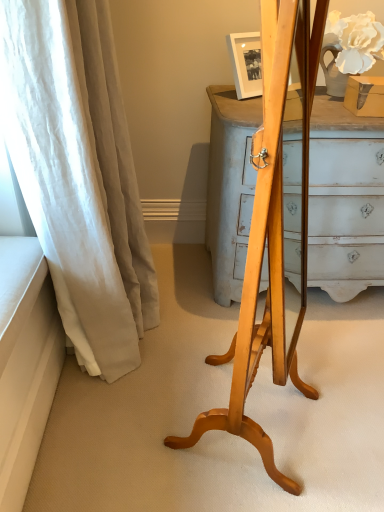
Question: Considering the positions of point (16, 94) and point (268, 193), is point (16, 94) closer or farther from the camera than point (268, 193)?

Choices:
 (A) farther
 (B) closer

Answer: (A)

Question: From a real-world perspective, relative to light wood easel at center, is white linen curtain at left vertically above or below?

Choices:
 (A) above
 (B) below

Answer: (B)

Question: Do you think white linen curtain at left is within light wood easel at center, or outside of it?

Choices:
 (A) outside
 (B) inside

Answer: (A)

Question: Considering the positions of light wood easel at center and white linen curtain at left in the image, is light wood easel at center wider or thinner than white linen curtain at left?

Choices:
 (A) wide
 (B) thin

Answer: (B)

Question: From the image's perspective, is light wood easel at center above or below white linen curtain at left?

Choices:
 (A) above
 (B) below

Answer: (B)

Question: Is point (279, 288) positioned closer to the camera than point (1, 66)?

Choices:
 (A) farther
 (B) closer

Answer: (B)

Question: Relative to white linen curtain at left, is light wood easel at center in front or behind?

Choices:
 (A) front
 (B) behind

Answer: (A)